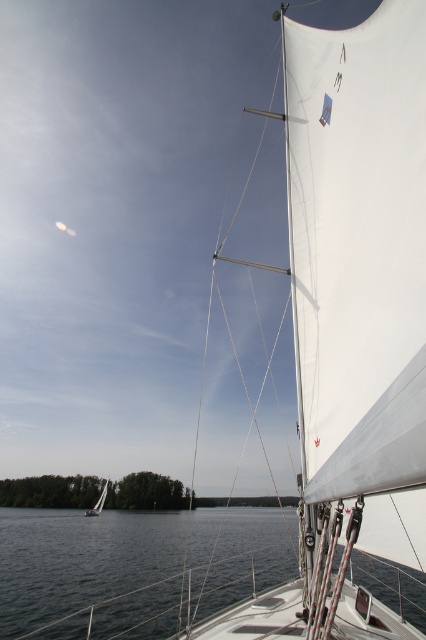
Question: In this image, where is dark blue water at lower center located relative to white matte sailboat at lower left?

Choices:
 (A) right
 (B) left

Answer: (A)

Question: Can you confirm if dark blue water at lower center is positioned above white matte sailboat at lower left?

Choices:
 (A) no
 (B) yes

Answer: (B)

Question: Does dark blue water at lower center have a smaller size compared to white matte sailboat at lower left?

Choices:
 (A) yes
 (B) no

Answer: (B)